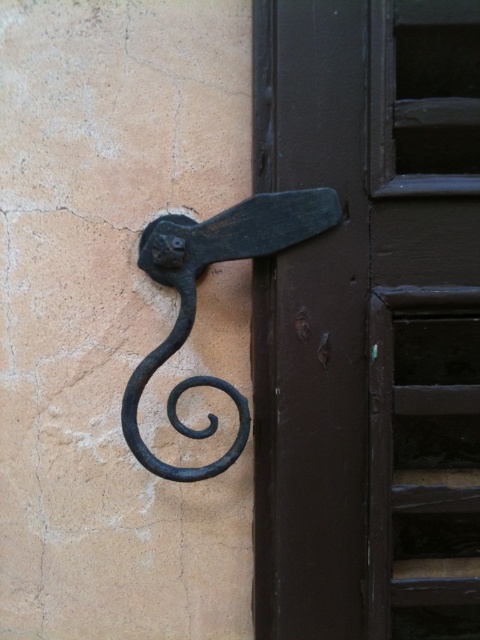
Between point (466, 490) and point (276, 227), which one is positioned behind?

The point (466, 490) is behind.

Find the location of a particular element. This screenshot has width=480, height=640. dark brown wood door at center is located at coordinates (368, 321).